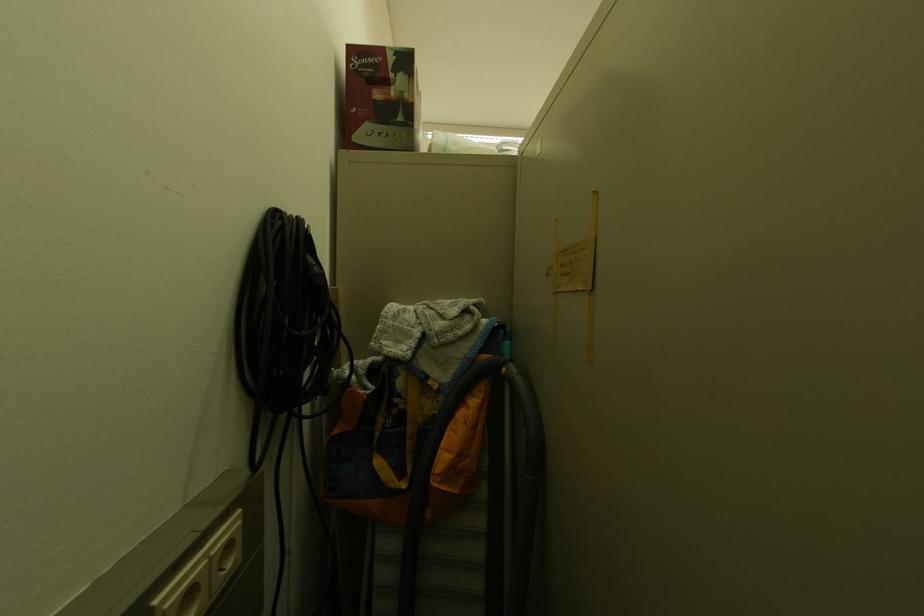
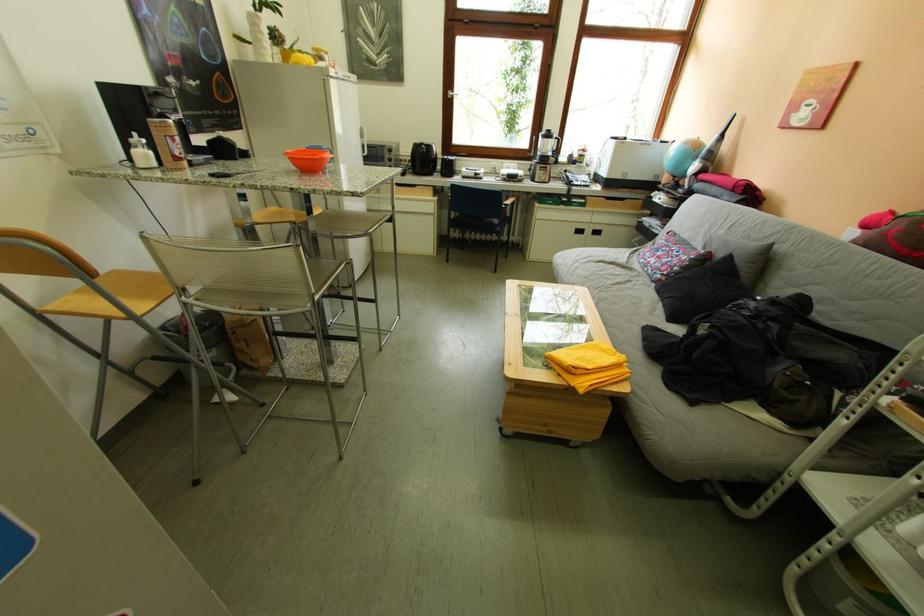
The images are taken continuously from a first-person perspective. In which direction are you moving?

The movement direction of the cameraman is right, forward.